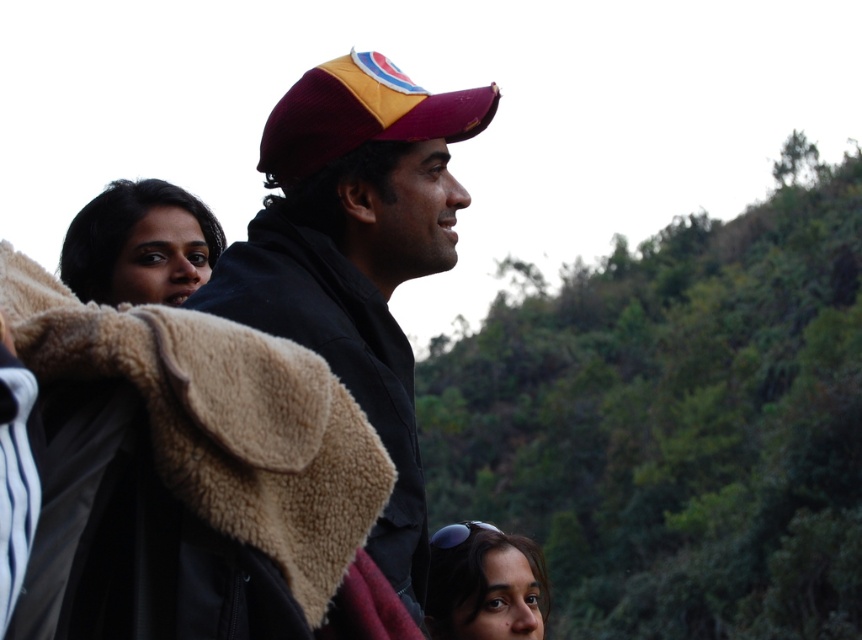
You are a photographer trying to capture a clear shot of both the maroon fabric cap at center and the smooth brown hair at lower center. Which object should you adjust your camera focus to first if you want to ensure both are in focus, considering their sizes?

The maroon fabric cap at center has a larger width than the smooth brown hair at lower center, so you should focus on the larger object first to ensure both are in focus.

You are standing at point [182,444] in the scene. What object is located exactly at this point?

The beige fleece jacket at center is located exactly at point [182,444].

You are a photographer standing at the scene. You want to take a photo of the beige fleece jacket at center and the smooth brown hair at lower center. Given that your camera has a maximum focus range of 10 meters, will both subjects be in focus?

The beige fleece jacket at center is 12.28 meters away from smooth brown hair at lower center. Since the camera can only focus up to 10 meters, the distance between them exceeds the maximum focus range. Therefore, both subjects cannot be in focus simultaneously.